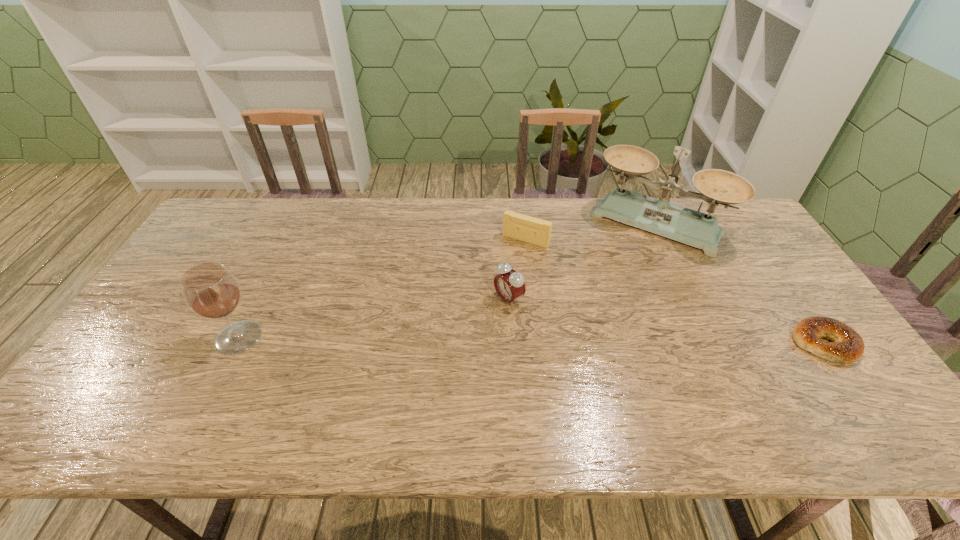
Identify which object is located as the fourth nearest to the third tallest object. Please provide its 2D coordinates. Your answer should be formatted as a tuple, i.e. [(x, y)], where the tuple contains the x and y coordinates of a point satisfying the conditions above.

[(847, 345)]

Where is `vacant space that satisfies the following two spatial constraints: 1. on the back side of the videotape; 2. on the right side of the third tallest object`? The width and height of the screenshot is (960, 540). vacant space that satisfies the following two spatial constraints: 1. on the back side of the videotape; 2. on the right side of the third tallest object is located at coordinates (505, 240).

Locate an element on the screen. The height and width of the screenshot is (540, 960). free region that satisfies the following two spatial constraints: 1. on the back side of the second tallest object; 2. on the right side of the third shortest object is located at coordinates (258, 299).

Identify the location of free space that satisfies the following two spatial constraints: 1. on the front side of the videotape; 2. on the left side of the bagel. (538, 343).